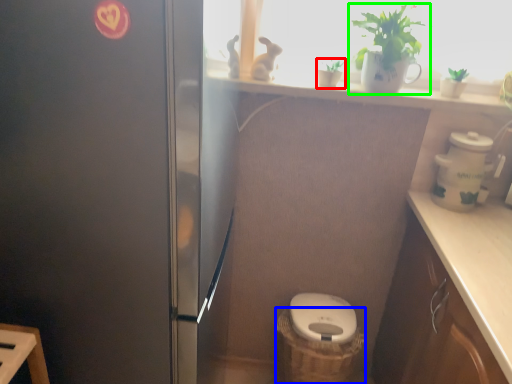
Question: Estimate the real-world distances between objects in this image. Which object is farther from houseplant (highlighted by a red box), basket container (highlighted by a blue box) or houseplant (highlighted by a green box)?

Choices:
 (A) basket container
 (B) houseplant

Answer: (A)